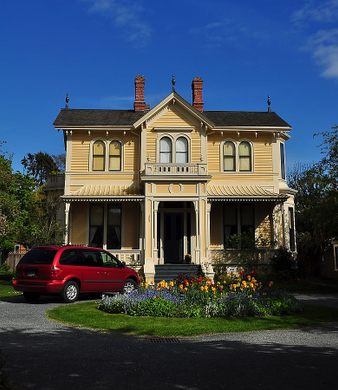
What are the coordinates of `the second level window` in the screenshot? It's located at (245, 163).